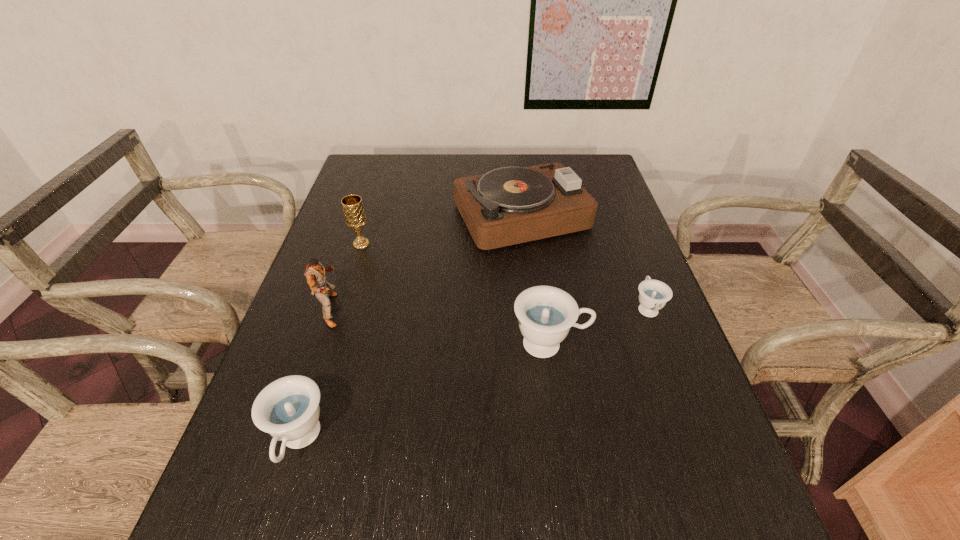
Locate an element on the screen. The height and width of the screenshot is (540, 960). the nearest object is located at coordinates [288, 409].

You are a GUI agent. You are given a task and a screenshot of the screen. Output one action in this format:
    pyautogui.click(x=<x>, y=<y>)
    Task: Click on the nearest teacup
    This screenshot has height=540, width=960.
    Given the screenshot: What is the action you would take?
    pyautogui.click(x=288, y=409)

The height and width of the screenshot is (540, 960). Find the location of `the second teacup from right to left`. the second teacup from right to left is located at coordinates (545, 313).

Where is `the rightmost teacup`? The image size is (960, 540). the rightmost teacup is located at coordinates (654, 294).

Where is `the shortest teacup`? This screenshot has width=960, height=540. the shortest teacup is located at coordinates [x=654, y=294].

Find the location of a particular element. record player is located at coordinates (506, 206).

Locate an element on the screen. This screenshot has width=960, height=540. chalice is located at coordinates (355, 218).

Locate an element on the screen. puncher is located at coordinates (315, 272).

Where is `free location located 0.130m on the side of the second teacup from right to left with the handle`? The image size is (960, 540). free location located 0.130m on the side of the second teacup from right to left with the handle is located at coordinates (647, 344).

In order to click on vacant area situated 0.120m on the side of the rightmost teacup with the handle in this screenshot , I will do coord(630,261).